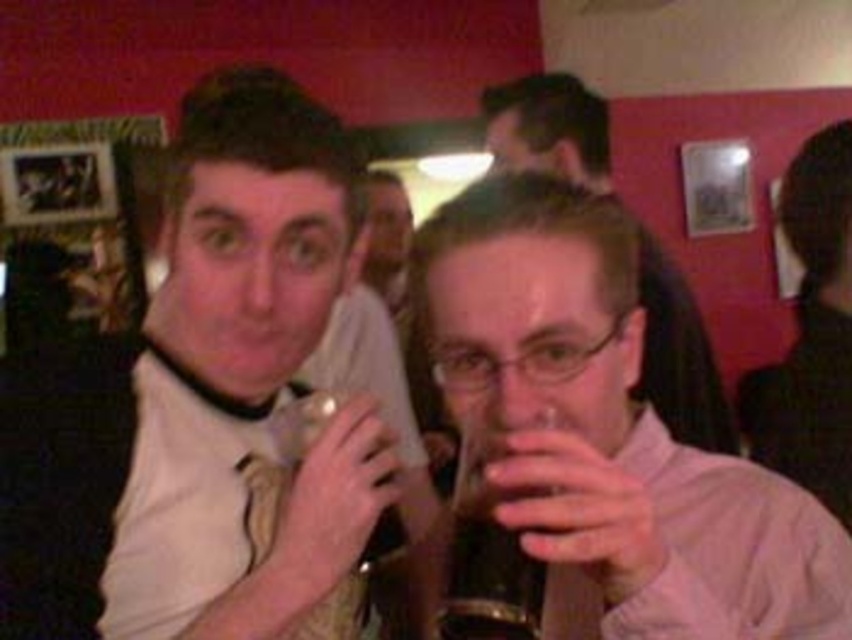
Measure the distance between point (806, 337) and camera.

Point (806, 337) and camera are 6.25 feet apart.

Who is positioned more to the left, smooth black hair at upper right or translucent glass beer at center?

Positioned to the left is translucent glass beer at center.

Is point (799, 173) positioned in front of point (536, 598)?

No, it is behind (536, 598).

You are a GUI agent. You are given a task and a screenshot of the screen. Output one action in this format:
    pyautogui.click(x=<x>, y=<y>)
    Task: Click on the smooth black hair at upper right
    This screenshot has height=640, width=852.
    Given the screenshot: What is the action you would take?
    pyautogui.click(x=810, y=332)

Based on the photo, is white matte shirt at left thinner than matte black hair at center?

Correct, white matte shirt at left's width is less than matte black hair at center's.

Is white matte shirt at left below matte black hair at center?

Yes.

Who is more forward, (41, 474) or (665, 253)?

Point (41, 474) is more forward.

Where is `white matte shirt at left`? white matte shirt at left is located at coordinates (204, 404).

Can you confirm if white matte shirt at left is shorter than smooth black hair at upper right?

Yes.

Is white matte shirt at left above smooth black hair at upper right?

Yes.

Between point (292, 198) and point (839, 291), which one is positioned behind?

The point (839, 291) is more distant.

Where is `white matte shirt at left`? white matte shirt at left is located at coordinates (204, 404).